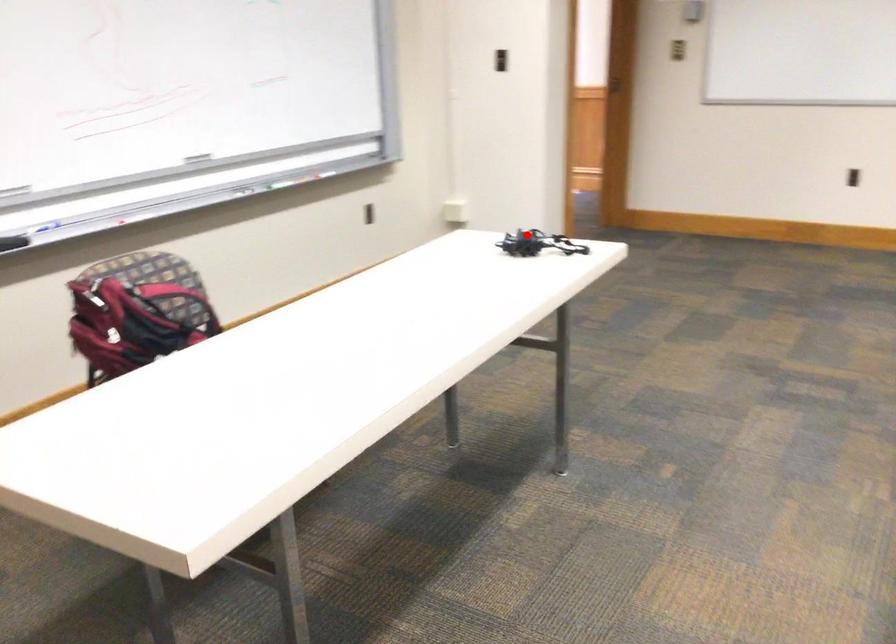
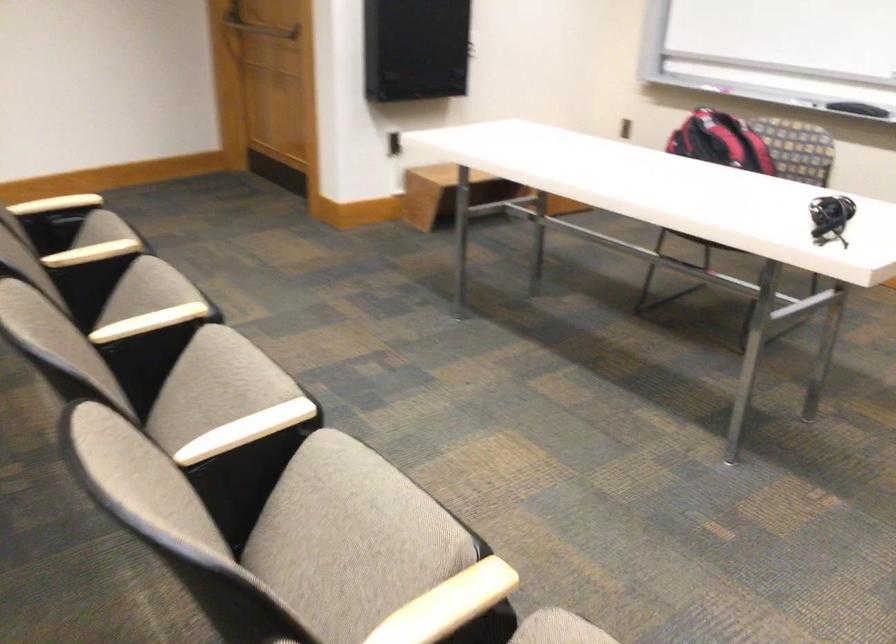
Find the pixel in the second image that matches the highlighted location in the first image.

(830, 218)